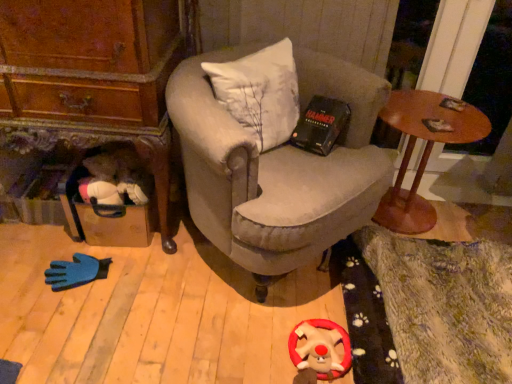
Question: From the image's perspective, is wooden round table at right located above or below velvet gray armchair at center?

Choices:
 (A) above
 (B) below

Answer: (A)

Question: In the image, is wooden round table at right on the left side or the right side of velvet gray armchair at center?

Choices:
 (A) left
 (B) right

Answer: (B)

Question: Considering the real-world distances, which object is closest to the velvet gray armchair at center?

Choices:
 (A) wooden round table at right
 (B) velvety red plush reindeer at lower center

Answer: (A)

Question: Estimate the real-world distances between objects in this image. Which object is farther from the velvet gray armchair at center?

Choices:
 (A) wooden round table at right
 (B) velvety red plush reindeer at lower center

Answer: (B)